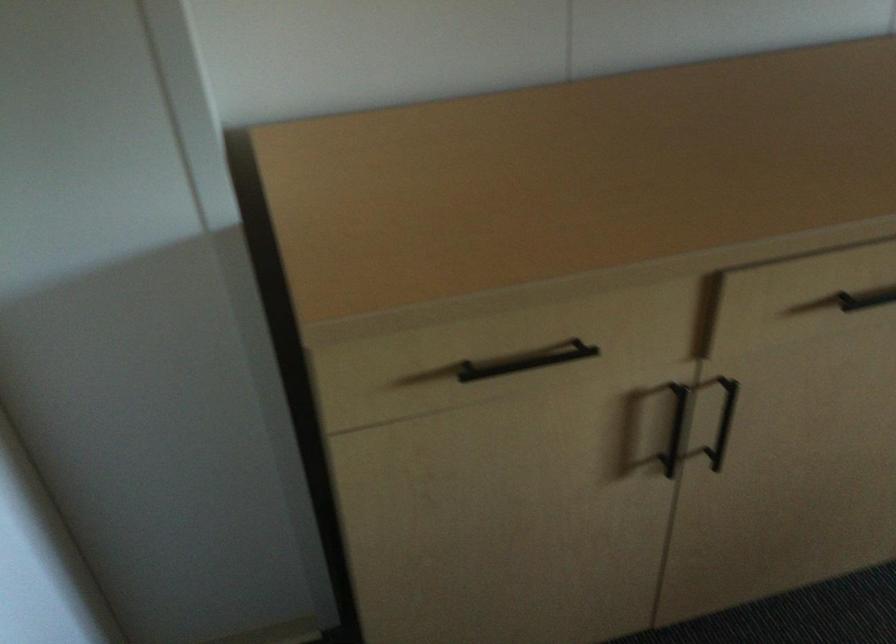
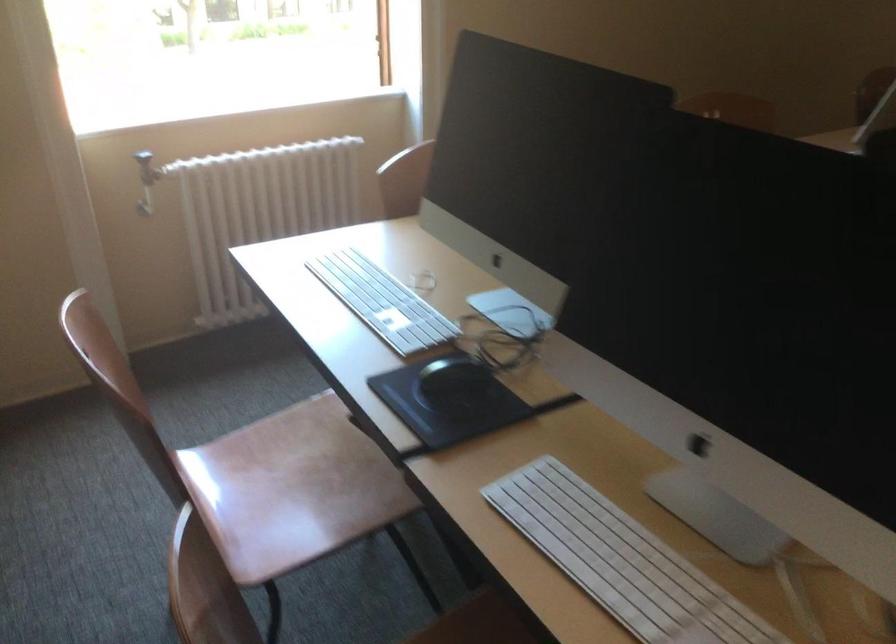
How did the camera likely rotate?

The rotation direction of the camera is right-down.